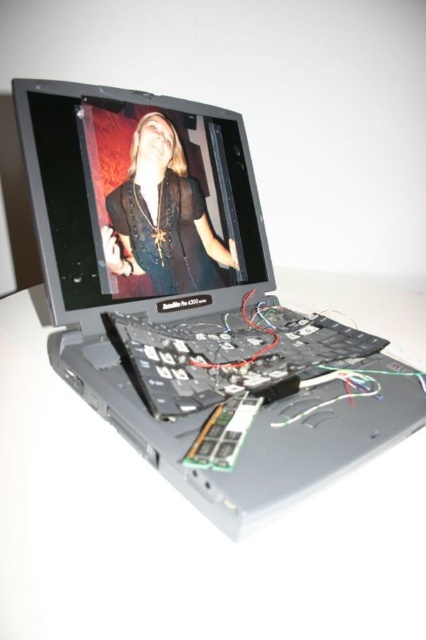
You are a technician working on a disassembled laptop. You need to locate the matte black screen at center. Where exactly is it positioned in the image?

The matte black screen at center is positioned at point (138, 196).

You are a technician trying to take a closeup photo of the satin black laptop at center. Your camera requires the subject to be exactly 10 inches away. Can you adjust your position to meet this requirement?

The satin black laptop at center is 10.70 inches away from camera. Since the required distance is 10 inches, you need to move the camera or the laptop closer by 0.70 inches to meet the requirement.

You are setting up a display for a tech exhibition and need to arrange the satin black laptop at center and the black plastic keyboard at center in a specific order. According to the image, which object is positioned to the left of the other?

The satin black laptop at center is to the left of the black plastic keyboard at center.